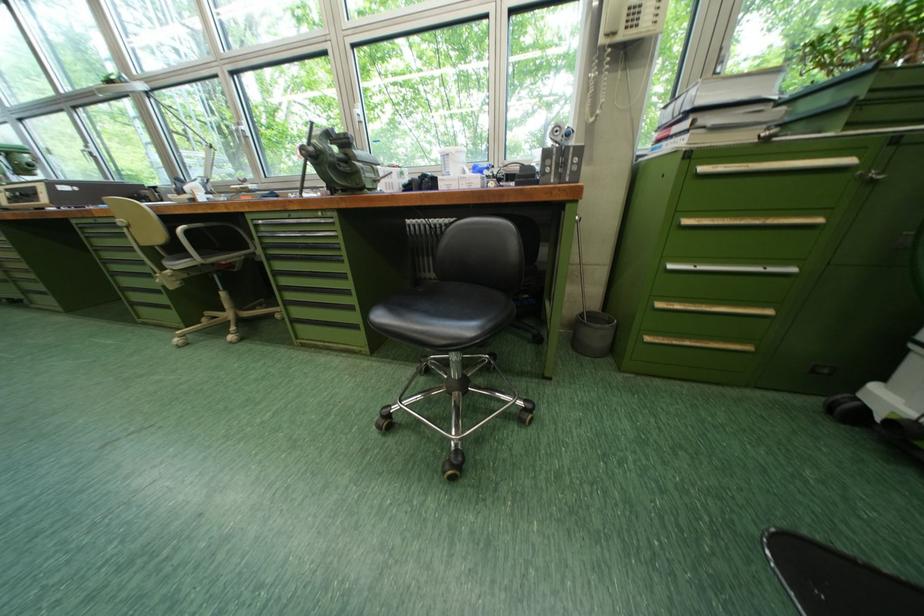
Which object does [721,111] point to?

This point indicates the stacked book.